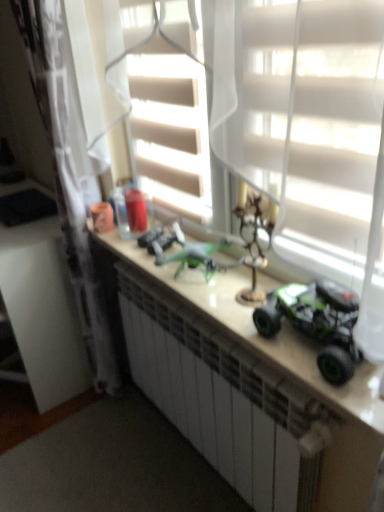
What are the coordinates of `free location to the left of green matte toy car at center, which ranks as the 3th toy in front-to-back order` in the screenshot? It's located at (122, 243).